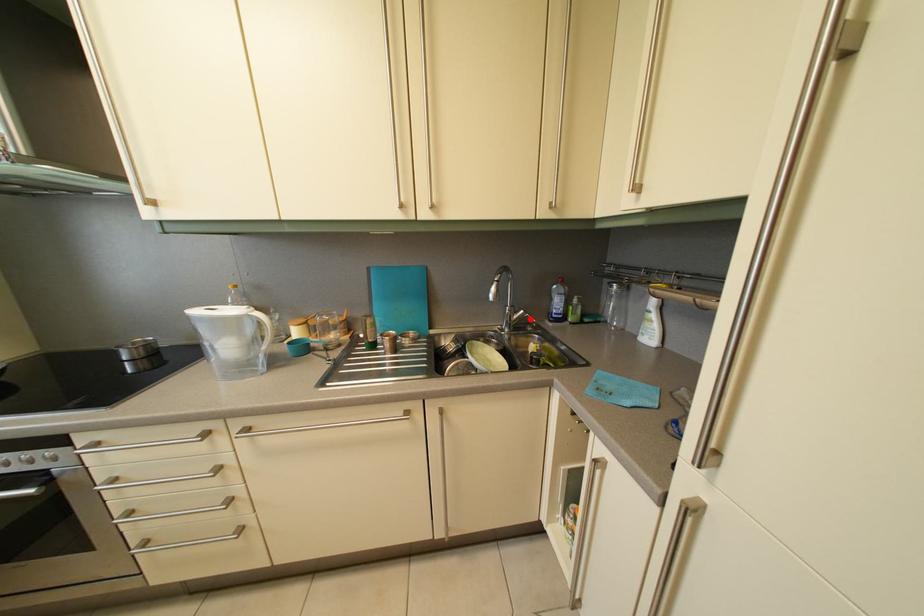
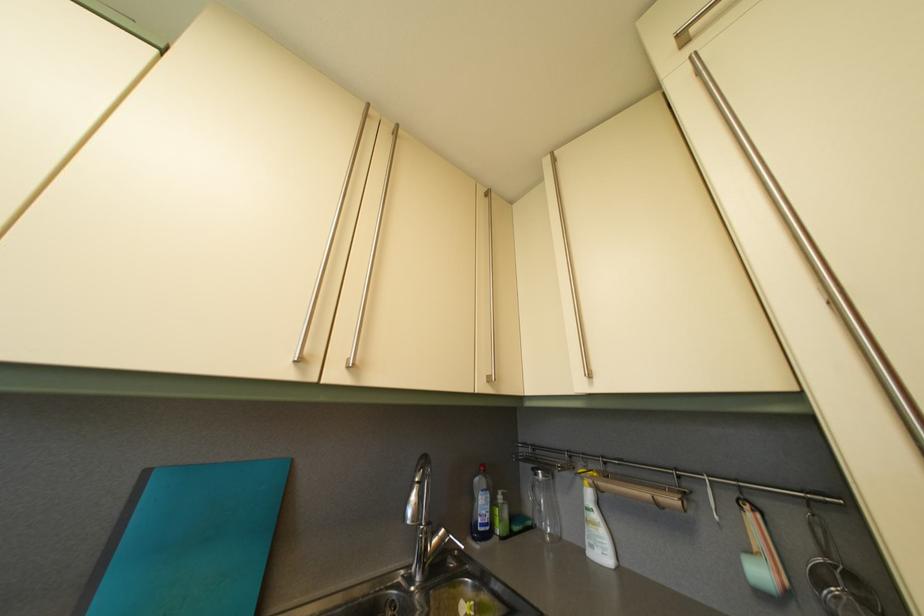
Question: I am providing you with two images of the same scene from different viewpoints. A red point is marked on the first image. At the location where the point appears in image 1, is it still visible in image 2?

Choices:
 (A) Yes
 (B) No

Answer: (A)